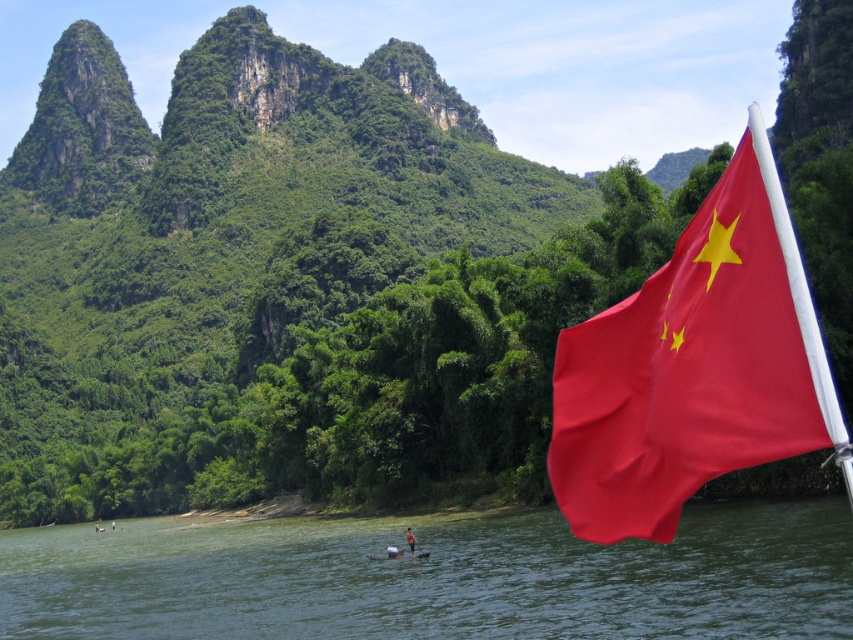
Question: Among these objects, which one is farthest from the camera?

Choices:
 (A) smooth skin person at lower center
 (B) smooth wooden boat at center
 (C) smooth red flag at right
 (D) green water at river right

Answer: (A)

Question: Observing the image, what is the correct spatial positioning of smooth red flag at right in reference to smooth skin person at lower center?

Choices:
 (A) below
 (B) above

Answer: (B)

Question: From the image, what is the correct spatial relationship of green water at river right in relation to smooth wooden boat at center?

Choices:
 (A) above
 (B) below

Answer: (B)

Question: Which object is the closest to the smooth skin person at lower center?

Choices:
 (A) smooth red flag at right
 (B) green water at river right
 (C) smooth wooden boat at center

Answer: (C)

Question: Estimate the real-world distances between objects in this image. Which object is farther from the smooth wooden boat at center?

Choices:
 (A) green water at river right
 (B) smooth red flag at right

Answer: (B)

Question: Is green water at river right further to the viewer compared to smooth wooden boat at center?

Choices:
 (A) no
 (B) yes

Answer: (A)